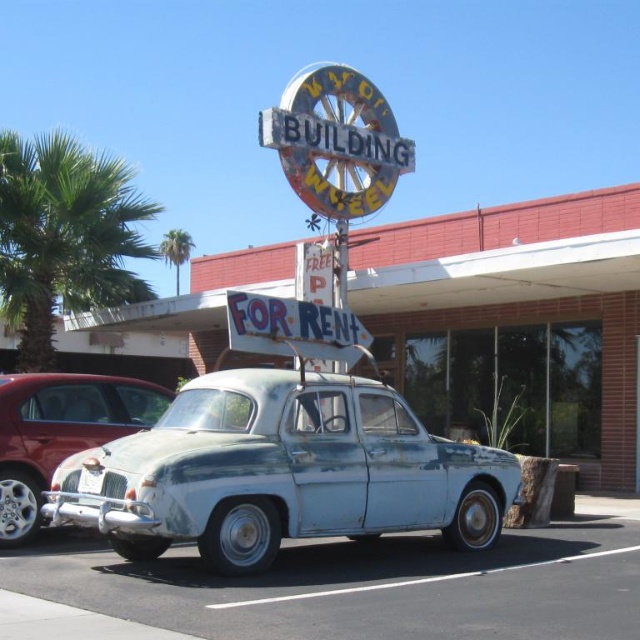
Question: Is rusty metallic car at center to the right of metallic/weathered sign at upper center from the viewer's perspective?

Choices:
 (A) yes
 (B) no

Answer: (A)

Question: Is rusty metallic car at center above metallic/weathered sign at upper center?

Choices:
 (A) yes
 (B) no

Answer: (B)

Question: Can you confirm if rusty metallic car at center is positioned below green leafy palm tree at upper left?

Choices:
 (A) yes
 (B) no

Answer: (A)

Question: Which object is the farthest from the metallic/weathered sign at upper center?

Choices:
 (A) metallic silver car at center
 (B) green leafy palm tree at left
 (C) green leafy palm tree at upper left
 (D) rusty metallic car at center

Answer: (C)

Question: Based on their relative distances, which object is nearer to the metallic silver car at center?

Choices:
 (A) metallic/weathered sign at upper center
 (B) green leafy palm tree at left
 (C) green leafy palm tree at upper left

Answer: (A)

Question: Among these points, which one is farthest from the camera?

Choices:
 (A) coord(28,209)
 (B) coord(120,420)

Answer: (A)